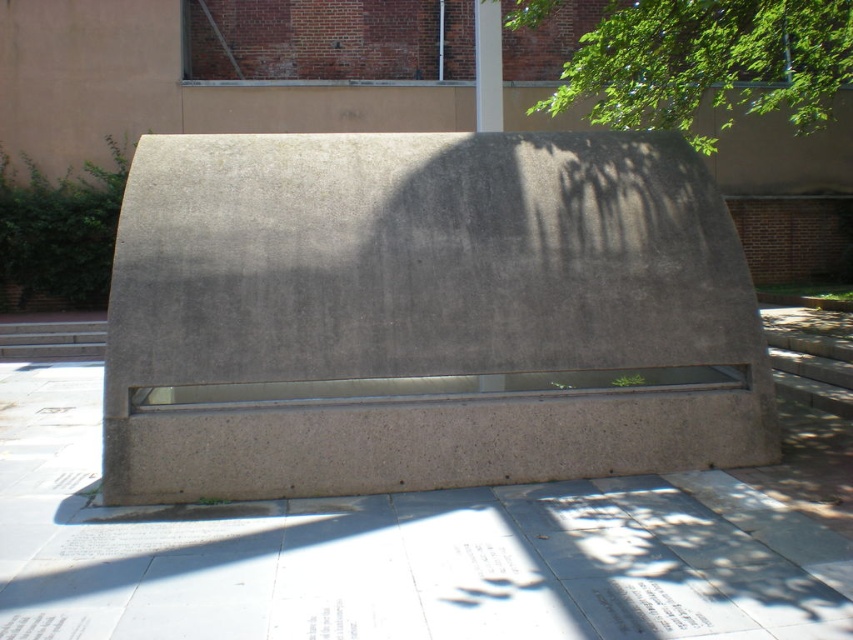
This screenshot has width=853, height=640. I want to click on gray concrete bench at center, so click(424, 316).

Between point (409, 387) and point (732, 118), which one is positioned behind?

The point (732, 118) is more distant.

You are a GUI agent. You are given a task and a screenshot of the screen. Output one action in this format:
    pyautogui.click(x=<x>, y=<y>)
    Task: Click on the gray concrete bench at center
    This screenshot has height=640, width=853.
    Given the screenshot: What is the action you would take?
    pyautogui.click(x=424, y=316)